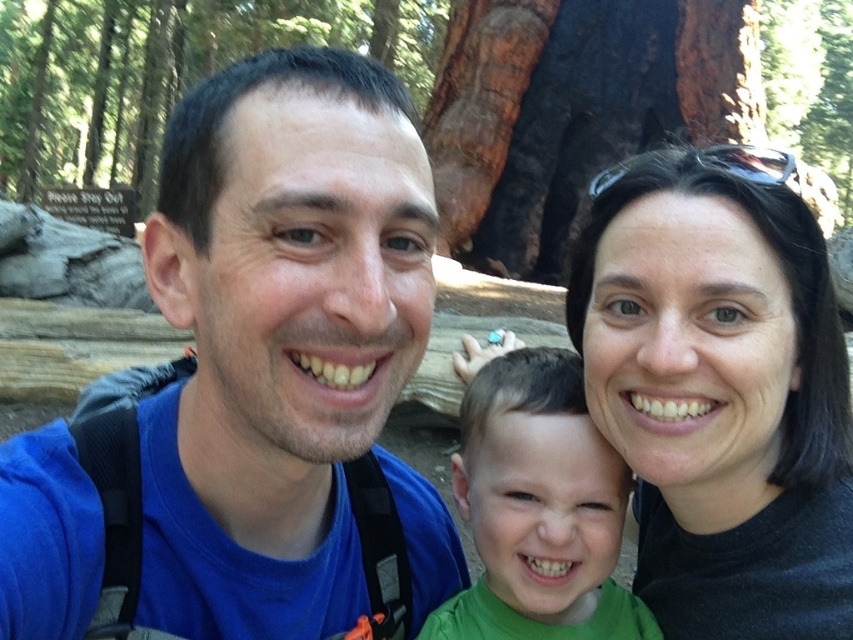
You are a photographer trying to capture a group photo of the family. You need to ensure that the blue fabric shirt at center and the green matte shirt at center are both visible in the frame. Based on their heights, which shirt will appear taller in the photo?

The green matte shirt at center will appear taller in the photo because it is taller than the blue fabric shirt at center.

You are a photographer trying to capture a clear shot of the black matte hair at upper right and the green matte shirt at center. Which object should you focus on first to ensure both are in focus?

The black matte hair at upper right is in front of the green matte shirt at center, so you should focus on the black matte hair at upper right first to ensure both are in focus.